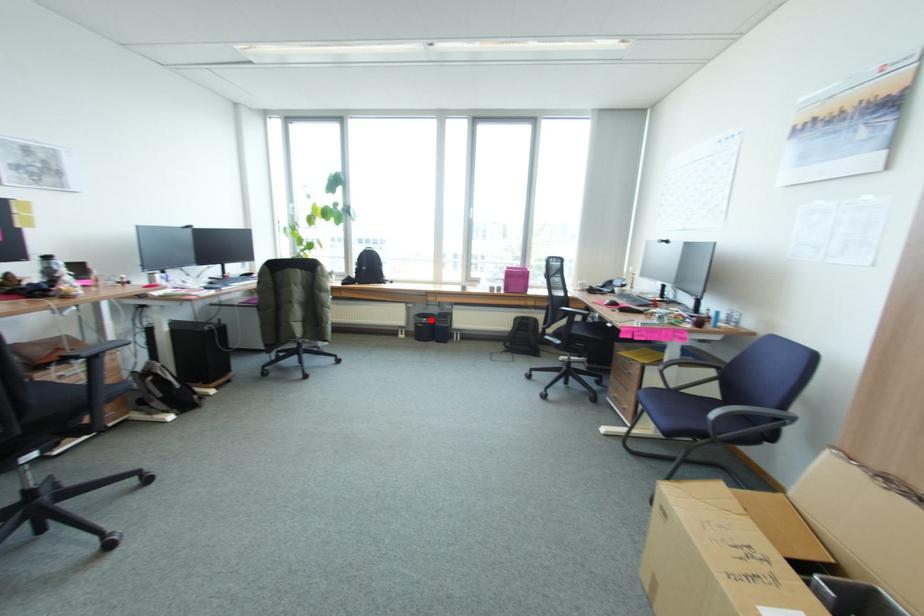
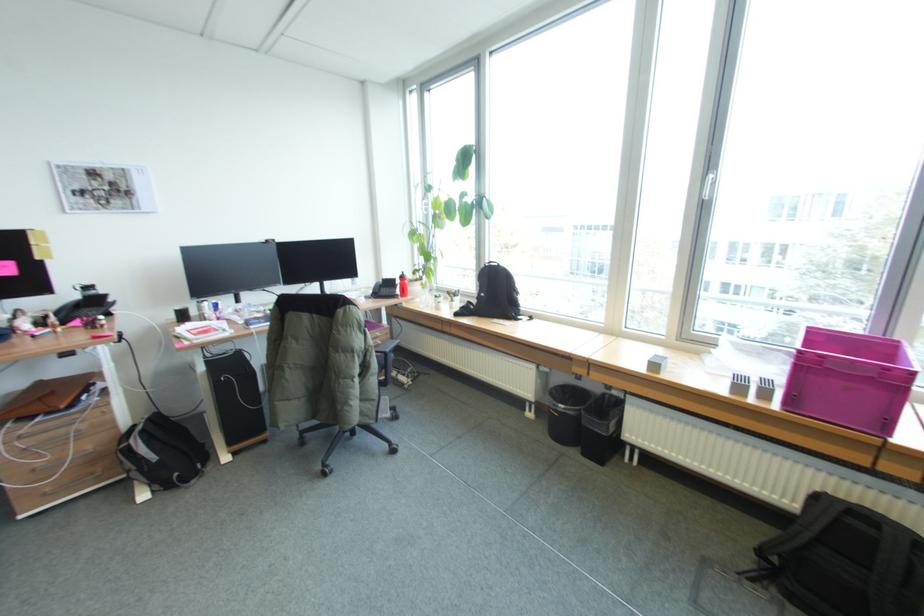
Where in the second image is the point corresponding to the highlighted location from the first image?

(568, 408)